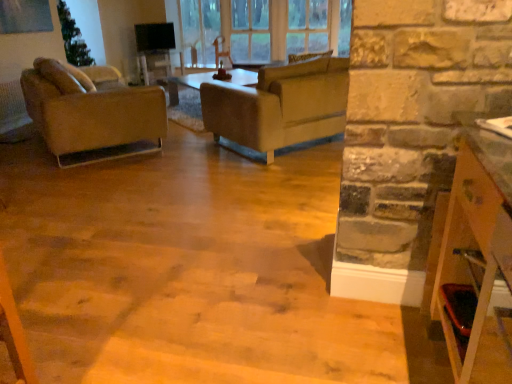
Question: Is the position of matte brown leather chair at left more distant than that of wooden shelf at right?

Choices:
 (A) no
 (B) yes

Answer: (B)

Question: Is matte brown leather chair at left looking in the opposite direction of wooden shelf at right?

Choices:
 (A) yes
 (B) no

Answer: (B)

Question: Can you confirm if matte brown leather chair at left is smaller than wooden shelf at right?

Choices:
 (A) yes
 (B) no

Answer: (B)

Question: Can you confirm if matte brown leather chair at left is shorter than wooden shelf at right?

Choices:
 (A) no
 (B) yes

Answer: (B)

Question: From the image's perspective, is matte brown leather chair at left over wooden shelf at right?

Choices:
 (A) yes
 (B) no

Answer: (A)

Question: Is clear glass window at upper center to the left or to the right of wooden shelf at right in the image?

Choices:
 (A) right
 (B) left

Answer: (B)

Question: Considering the positions of point tap(243, 21) and point tap(477, 208), is point tap(243, 21) closer or farther from the camera than point tap(477, 208)?

Choices:
 (A) closer
 (B) farther

Answer: (B)

Question: Considering their positions, is clear glass window at upper center located in front of or behind wooden shelf at right?

Choices:
 (A) behind
 (B) front

Answer: (A)

Question: From a real-world perspective, is clear glass window at upper center positioned above or below wooden shelf at right?

Choices:
 (A) below
 (B) above

Answer: (B)

Question: Choose the correct answer: Is wooden shelf at right inside leather couch at center or outside it?

Choices:
 (A) inside
 (B) outside

Answer: (B)

Question: Considering the positions of point (471, 218) and point (327, 132), is point (471, 218) closer or farther from the camera than point (327, 132)?

Choices:
 (A) closer
 (B) farther

Answer: (A)

Question: In the image, is wooden shelf at right positioned in front of or behind leather couch at center?

Choices:
 (A) front
 (B) behind

Answer: (A)

Question: From the image's perspective, is wooden shelf at right positioned above or below leather couch at center?

Choices:
 (A) below
 (B) above

Answer: (A)

Question: From the image's perspective, is leather couch at center positioned above or below wooden shelf at right?

Choices:
 (A) above
 (B) below

Answer: (A)

Question: Considering the positions of point pos(284,130) and point pos(500,374), is point pos(284,130) closer or farther from the camera than point pos(500,374)?

Choices:
 (A) closer
 (B) farther

Answer: (B)